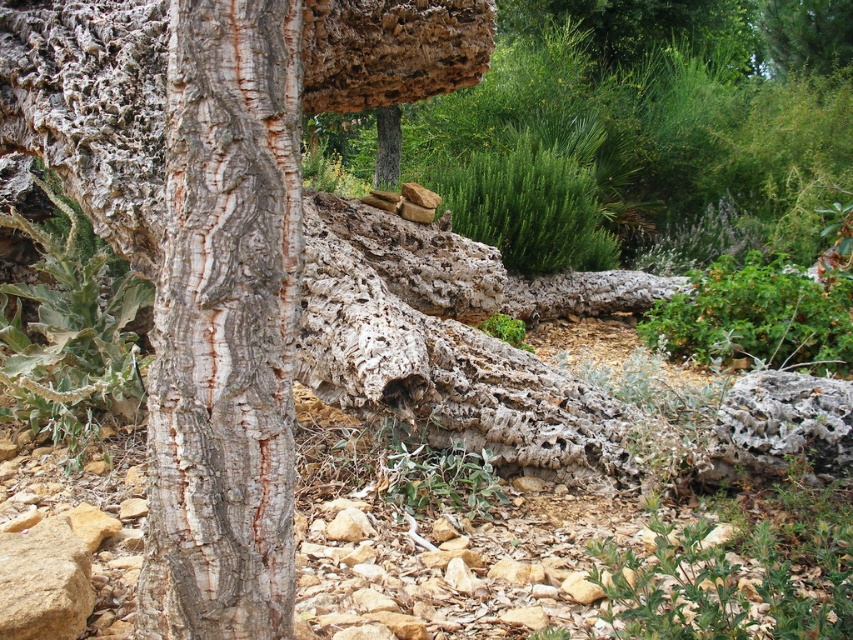
You are an artist sketching the scene. You want to draw the gray rough bark at center and the green leafy plant at center. Which one should you start with to capture the depth of the scene?

You should start with the gray rough bark at center because it is in front of the green leafy plant at center, so drawing it first will help establish the foreground before moving to the background elements.

You are a botanist examining the cork oak tree. You notice the gray rough bark at center and the green leafy plant at center. From your perspective, which object is positioned to the right?

The green leafy plant at center is positioned to the right of the gray rough bark at center.

You are an artist trying to sketch this scene. You notice the gray rough bark at center and the green leafy plant at center. Which object should you draw first if you want to focus on the narrower part of the scene?

You should draw the gray rough bark at center first because it has a lesser width compared to the green leafy plant at center, making it the narrower part of the scene.